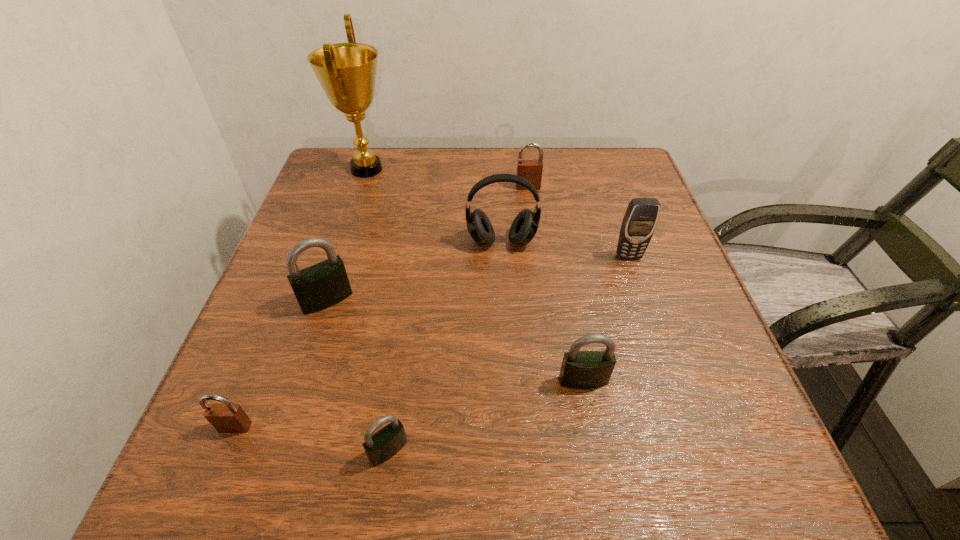
Identify the location of vacant space in between the cellular telephone and the second nearest black padlock. The width and height of the screenshot is (960, 540). (606, 319).

Locate an element on the screen. vacant space that is in between the headset and the second nearest object is located at coordinates (369, 334).

Where is `free area in between the sixth farthest object and the third padlock from left to right`? This screenshot has width=960, height=540. free area in between the sixth farthest object and the third padlock from left to right is located at coordinates (486, 416).

Select which object appears as the fifth closest to the fourth farthest padlock. Please provide its 2D coordinates. Your answer should be formatted as a tuple, i.e. [(x, y)], where the tuple contains the x and y coordinates of a point satisfying the conditions above.

[(347, 72)]

This screenshot has width=960, height=540. What are the coordinates of `object that is the fifth nearest to the nearest padlock` in the screenshot? It's located at (640, 219).

Select which padlock is the closest to the third padlock from left to right. Please provide its 2D coordinates. Your answer should be formatted as a tuple, i.e. [(x, y)], where the tuple contains the x and y coordinates of a point satisfying the conditions above.

[(226, 418)]

Image resolution: width=960 pixels, height=540 pixels. In order to click on padlock that stands as the third closest to the farthest padlock in this screenshot , I will do `click(384, 444)`.

Locate which black padlock ranks in proximity to the sixth farthest object. Please provide its 2D coordinates. Your answer should be formatted as a tuple, i.e. [(x, y)], where the tuple contains the x and y coordinates of a point satisfying the conditions above.

[(384, 444)]

Locate an element on the screen. The image size is (960, 540). black padlock that is the third closest one to the bigger brown padlock is located at coordinates (384, 444).

You are a GUI agent. You are given a task and a screenshot of the screen. Output one action in this format:
    pyautogui.click(x=<x>, y=<y>)
    Task: Click on the free space that satisfies the following two spatial constraints: 1. on the ear cups of the black headset; 2. on the left side of the second farthest black padlock
    The height and width of the screenshot is (540, 960).
    Given the screenshot: What is the action you would take?
    pyautogui.click(x=509, y=381)